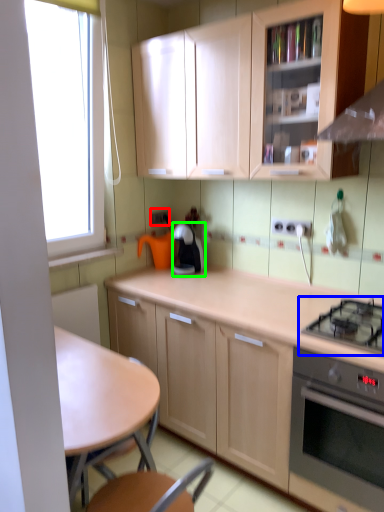
Question: Considering the real-world distances, which object is closest to electric outlet (highlighted by a red box)? gas stove (highlighted by a blue box) or kitchen appliance (highlighted by a green box).

Choices:
 (A) gas stove
 (B) kitchen appliance

Answer: (B)